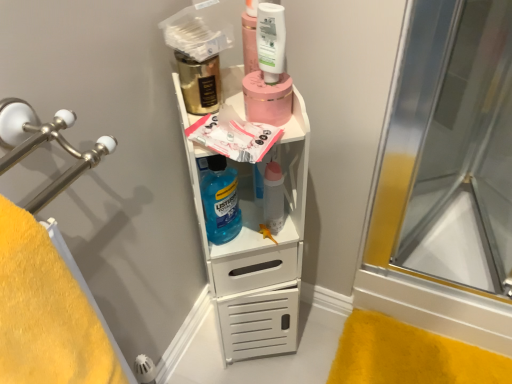
Describe the element at coordinates (220, 201) in the screenshot. Image resolution: width=512 pixels, height=384 pixels. I see `blue translucent mouthwash at center` at that location.

What do you see at coordinates (273, 197) in the screenshot? I see `translucent plastic bottle at center` at bounding box center [273, 197].

Identify the location of transparent glass shower door at right. This screenshot has width=512, height=384. (467, 161).

Locate an element on the screen. blue translucent mouthwash at center is located at coordinates (220, 201).

Based on the photo, which of these two, white glossy mouthwash at upper center, which is the first mouthwash in right-to-left order, or white matte cabinet at center, stands taller?

white matte cabinet at center.

Is white glossy mouthwash at upper center, arranged as the first mouthwash when viewed from the front, outside of white matte cabinet at center?

white glossy mouthwash at upper center, arranged as the first mouthwash when viewed from the front, lies outside white matte cabinet at center's area.

Is white matte cabinet at center at the back of white glossy mouthwash at upper center, which ranks as the second mouthwash in left-to-right order?

white glossy mouthwash at upper center, which ranks as the second mouthwash in left-to-right order, does not have its back to white matte cabinet at center.

Is point (280, 14) behind point (228, 94)?

No, it is not.

Is white matte cabinet at center positioned far away from white glossy mouthwash at upper center, which ranks as the second mouthwash in left-to-right order?

No, white matte cabinet at center is not far from white glossy mouthwash at upper center, which ranks as the second mouthwash in left-to-right order.

Is point (237, 360) closer to camera compared to point (271, 19)?

No, (237, 360) is behind (271, 19).

Does white matte cabinet at center have a smaller size compared to white glossy mouthwash at upper center, which ranks as the second mouthwash in left-to-right order?

No, white matte cabinet at center is not smaller than white glossy mouthwash at upper center, which ranks as the second mouthwash in left-to-right order.

In the scene shown: Measure the distance between white matte cabinet at center and white glossy mouthwash at upper center, arranged as the first mouthwash when viewed from the front.

15.47 inches.

Is white glossy mouthwash at upper center, positioned as the 2th mouthwash in back-to-front order, located outside translucent plastic bottle at center?

white glossy mouthwash at upper center, positioned as the 2th mouthwash in back-to-front order, is positioned outside translucent plastic bottle at center.

In the scene shown: Measure the distance between white glossy mouthwash at upper center, which is the first mouthwash in right-to-left order, and translucent plastic bottle at center.

A distance of 27.11 centimeters exists between white glossy mouthwash at upper center, which is the first mouthwash in right-to-left order, and translucent plastic bottle at center.

Which is behind, white glossy mouthwash at upper center, which ranks as the second mouthwash in left-to-right order, or translucent plastic bottle at center?

translucent plastic bottle at center is behind.

Which is more to the right, white glossy mouthwash at upper center, which ranks as the second mouthwash in left-to-right order, or translucent plastic bottle at center?

Positioned to the right is translucent plastic bottle at center.

From a real-world perspective, is yellow fluffy towel at left physically located above or below translucent plastic bottle at center?

Clearly, from a real-world perspective, yellow fluffy towel at left is below translucent plastic bottle at center.

Does point (37, 382) lie in front of point (279, 175)?

Yes, point (37, 382) is in front of point (279, 175).

From the picture: Considering the sizes of yellow fluffy towel at left and translucent plastic bottle at center in the image, is yellow fluffy towel at left wider or thinner than translucent plastic bottle at center?

Considering their sizes, yellow fluffy towel at left looks broader than translucent plastic bottle at center.

Is translucent plastic bottle at center at the back of yellow fluffy towel at left?

No.

Considering the relative positions of pink matte jar at upper center and gold metallic mouthwash at upper center, which ranks as the first mouthwash in left-to-right order, in the image provided, is pink matte jar at upper center to the right of gold metallic mouthwash at upper center, which ranks as the first mouthwash in left-to-right order, from the viewer's perspective?

Yes, pink matte jar at upper center is to the right of gold metallic mouthwash at upper center, which ranks as the first mouthwash in left-to-right order.

This screenshot has width=512, height=384. I want to click on product that is under the gold metallic mouthwash at upper center, acting as the first mouthwash starting from the back (from a real-world perspective), so click(x=267, y=99).

Is pink matte jar at upper center directly adjacent to gold metallic mouthwash at upper center, which is the 2th mouthwash from right to left?

No, pink matte jar at upper center is not with gold metallic mouthwash at upper center, which is the 2th mouthwash from right to left.

Is pink matte jar at upper center facing towards gold metallic mouthwash at upper center, the second mouthwash in the front-to-back sequence?

No, pink matte jar at upper center is not oriented towards gold metallic mouthwash at upper center, the second mouthwash in the front-to-back sequence.

Is white matte cabinet at center beside gold metallic mouthwash at upper center, acting as the first mouthwash starting from the back?

No, white matte cabinet at center is not with gold metallic mouthwash at upper center, acting as the first mouthwash starting from the back.

From the image's perspective, which one is positioned higher, white matte cabinet at center or gold metallic mouthwash at upper center, which is the 2th mouthwash from right to left?

gold metallic mouthwash at upper center, which is the 2th mouthwash from right to left.

In the image, is white matte cabinet at center on the left side or the right side of gold metallic mouthwash at upper center, which is the 2th mouthwash from right to left?

Based on their positions, white matte cabinet at center is located to the right of gold metallic mouthwash at upper center, which is the 2th mouthwash from right to left.

Who is more distant, transparent glass shower door at right or yellow fluffy towel at left?

Positioned behind is transparent glass shower door at right.

From a real-world perspective, is transparent glass shower door at right over yellow fluffy towel at left?

Yes.

You are a GUI agent. You are given a task and a screenshot of the screen. Output one action in this format:
    pyautogui.click(x=<x>, y=<y>)
    Task: Click on the bath towel below the transparent glass shower door at right (from the image's perspective)
    The image size is (512, 384).
    Given the screenshot: What is the action you would take?
    pyautogui.click(x=46, y=312)

Between transparent glass shower door at right and yellow fluffy towel at left, which one has less height?

Standing shorter between the two is yellow fluffy towel at left.

You are a GUI agent. You are given a task and a screenshot of the screen. Output one action in this format:
    pyautogui.click(x=<x>, y=<y>)
    Task: Click on the 2nd mouthwash above the white matte cabinet at center (from the image's perspective)
    The width and height of the screenshot is (512, 384).
    Given the screenshot: What is the action you would take?
    pyautogui.click(x=271, y=41)

You are a GUI agent. You are given a task and a screenshot of the screen. Output one action in this format:
    pyautogui.click(x=<x>, y=<y>)
    Task: Click on the mouthwash on the right of white matte cabinet at center
    The image size is (512, 384).
    Given the screenshot: What is the action you would take?
    pyautogui.click(x=271, y=41)

Which object lies further to the anchor point gold metallic mouthwash at upper center, which is the 2th mouthwash from right to left, yellow fluffy towel at left or white matte cabinet at center?

yellow fluffy towel at left lies further to gold metallic mouthwash at upper center, which is the 2th mouthwash from right to left, than the other object.

Which object lies further to the anchor point gold metallic mouthwash at upper center, acting as the first mouthwash starting from the back, pink matte jar at upper center or white glossy mouthwash at upper center, arranged as the first mouthwash when viewed from the front?

The object further to gold metallic mouthwash at upper center, acting as the first mouthwash starting from the back, is white glossy mouthwash at upper center, arranged as the first mouthwash when viewed from the front.

Estimate the real-world distances between objects in this image. Which object is further from blue translucent mouthwash at center, pink matte jar at upper center or white matte cabinet at center?

pink matte jar at upper center.

Estimate the real-world distances between objects in this image. Which object is further from white matte cabinet at center, gold metallic mouthwash at upper center, which ranks as the first mouthwash in left-to-right order, or translucent plastic bottle at center?

Based on the image, gold metallic mouthwash at upper center, which ranks as the first mouthwash in left-to-right order, appears to be further to white matte cabinet at center.

When comparing their distances from blue translucent mouthwash at center, does transparent glass shower door at right or white glossy mouthwash at upper center, which is the first mouthwash in right-to-left order, seem further?

transparent glass shower door at right.

When comparing their distances from yellow fluffy towel at left, does white glossy mouthwash at upper center, arranged as the first mouthwash when viewed from the front, or translucent plastic bottle at center seem closer?

white glossy mouthwash at upper center, arranged as the first mouthwash when viewed from the front, is positioned closer to the anchor yellow fluffy towel at left.

Estimate the real-world distances between objects in this image. Which object is further from blue translucent mouthwash at center, pink matte jar at upper center or translucent plastic bottle at center?

pink matte jar at upper center is positioned further to the anchor blue translucent mouthwash at center.

From the image, which object appears to be nearer to transparent glass shower door at right, translucent plastic bottle at center or blue translucent mouthwash at center?

translucent plastic bottle at center lies closer to transparent glass shower door at right than the other object.

Identify the location of cleaning product situated between gold metallic mouthwash at upper center, which ranks as the first mouthwash in left-to-right order, and transparent glass shower door at right from left to right. (220, 201).

Where is `bathroom cabinet between white glossy mouthwash at upper center, which is the first mouthwash in right-to-left order, and yellow fluffy towel at left from top to bottom`? bathroom cabinet between white glossy mouthwash at upper center, which is the first mouthwash in right-to-left order, and yellow fluffy towel at left from top to bottom is located at coordinates (259, 253).

Locate an element on the screen. This screenshot has width=512, height=384. toiletry between blue translucent mouthwash at center and transparent glass shower door at right is located at coordinates (273, 197).

At what (x,y) coordinates should I click in order to perform the action: click on mouthwash between white glossy mouthwash at upper center, which ranks as the second mouthwash in left-to-right order, and translucent plastic bottle at center in the up-down direction. Please return your answer as a coordinate pair (x, y). The image size is (512, 384). Looking at the image, I should click on (199, 83).